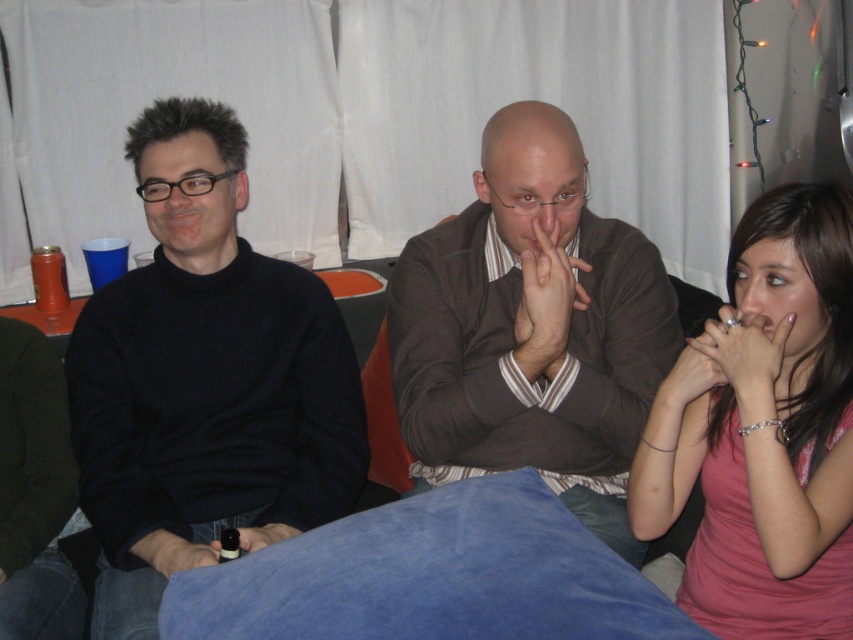
You are standing at the entrance of the room and want to hand a gift to the person wearing the brown sweater at center. You can only walk straight towards them. Is there enough space between the people to reach them without moving the others?

The people are 4.21 feet apart, so there is enough space to walk straight to the brown sweater at center without moving the others.

You are standing in the room and want to locate the brown sweater at center. Where is it located relative to the point marked at coordinates (531, 330)?

The point marked at coordinates (531, 330) corresponds to the brown sweater at center, so it is exactly at that location.